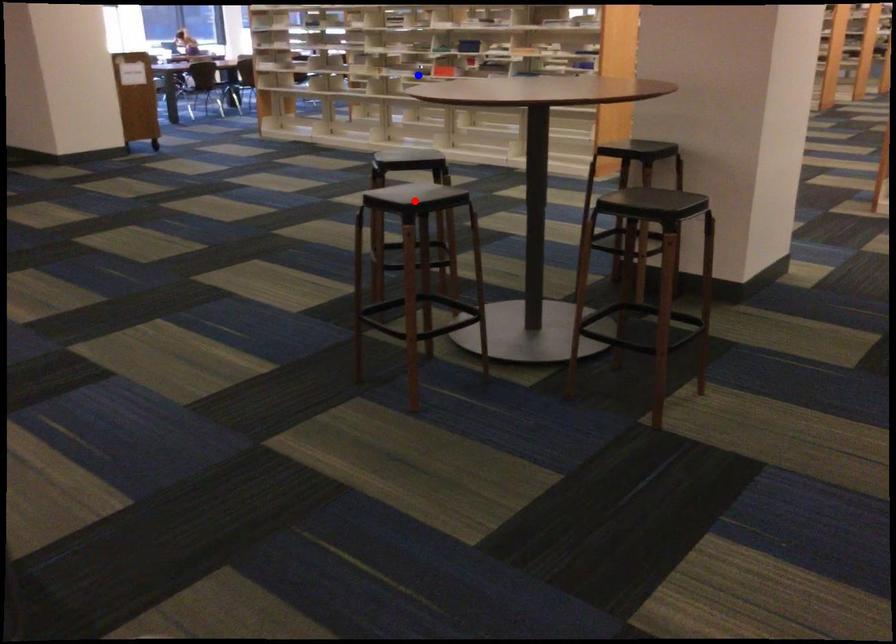
Question: Which of the two points in the image is closer to the camera?

Choices:
 (A) Blue point is closer.
 (B) Red point is closer.

Answer: (B)